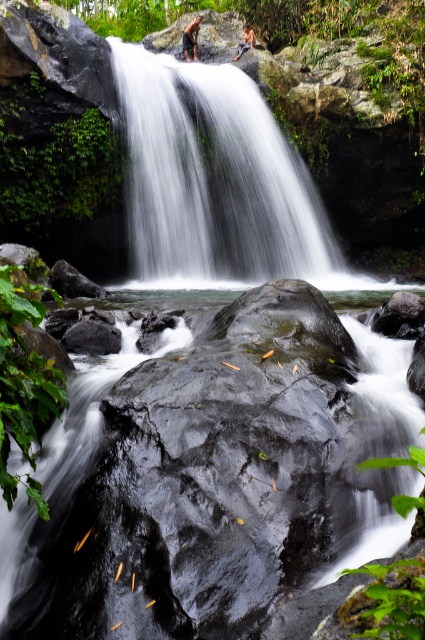
Locate an element on the screen. brown furry bear at upper center is located at coordinates (190, 38).

Is brown furry bear at upper center bigger than smooth skin person at upper center?

No.

Is point (190, 22) positioned after point (246, 42)?

Yes, point (190, 22) is farther from viewer.

The image size is (425, 640). What are the coordinates of `brown furry bear at upper center` in the screenshot? It's located at (190, 38).

Which is behind, point (156, 243) or point (193, 36)?

Positioned behind is point (193, 36).

At what (x,y) coordinates should I click in order to perform the action: click on white smooth waterfall at center. Please return your answer as a coordinate pair (x, y). The width and height of the screenshot is (425, 640). Looking at the image, I should click on (215, 177).

Is point (172, 612) farther from camera compared to point (246, 28)?

No, (172, 612) is in front of (246, 28).

Does glossy rock at center have a smaller size compared to smooth skin person at upper center?

No.

In order to click on glossy rock at center in this screenshot , I will do `click(207, 484)`.